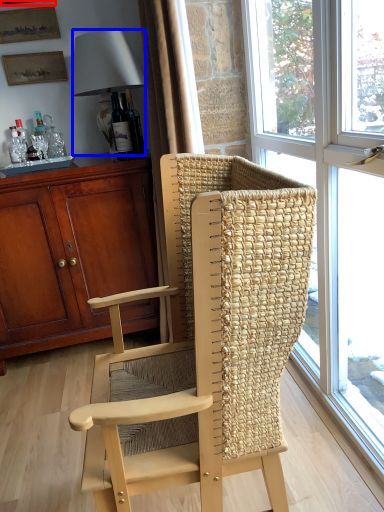
Question: Which of the following is the closest to the observer, picture frame (highlighted by a red box) or lamp (highlighted by a blue box)?

Choices:
 (A) picture frame
 (B) lamp

Answer: (B)